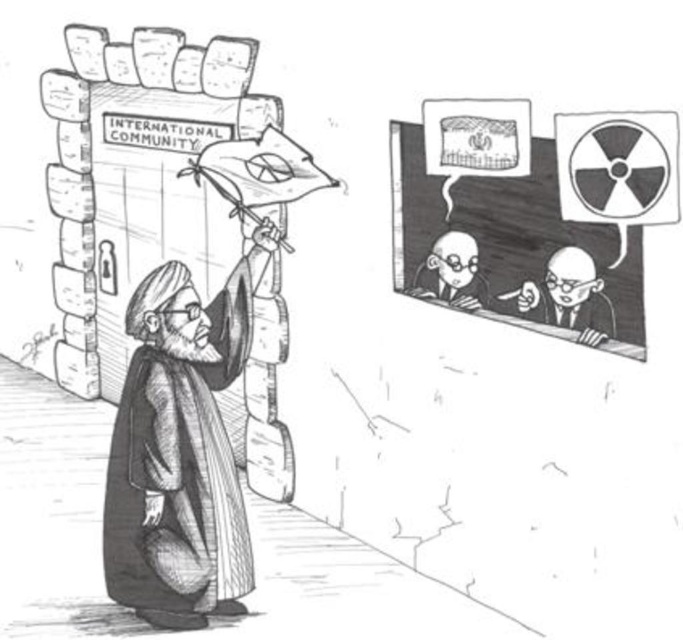
Question: Is smooth woolen robe at center further to camera compared to smooth skin man at center?

Choices:
 (A) yes
 (B) no

Answer: (A)

Question: Which object is the farthest from the smooth skin man at center?

Choices:
 (A) smooth paper flag at upper center
 (B) smooth skin bald man at center
 (C) smooth woolen robe at center

Answer: (C)

Question: Which point is closer to the camera?

Choices:
 (A) (469, 248)
 (B) (591, 260)

Answer: (B)

Question: Among these objects, which one is nearest to the camera?

Choices:
 (A) smooth woolen robe at center
 (B) smooth skin man at center

Answer: (B)

Question: Does smooth skin man at center appear over smooth skin bald man at center?

Choices:
 (A) yes
 (B) no

Answer: (B)

Question: Can you confirm if smooth woolen robe at center is positioned to the left of smooth skin man at center?

Choices:
 (A) yes
 (B) no

Answer: (A)